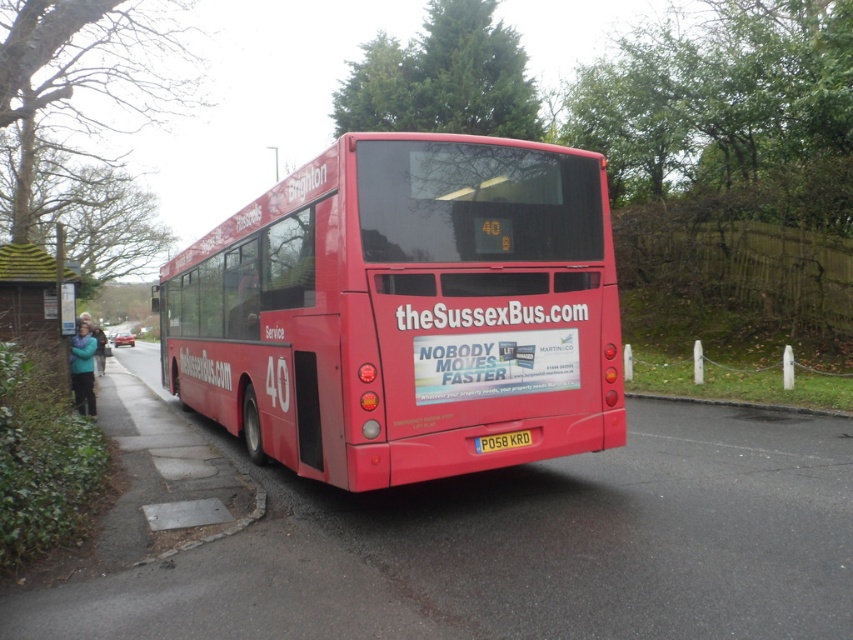
In the scene shown: Does wooden thatched roof at left appear on the left side of yellow plastic license plate at center?

Indeed, wooden thatched roof at left is positioned on the left side of yellow plastic license plate at center.

At what (x,y) coordinates should I click in order to perform the action: click on wooden thatched roof at left. Please return your answer as a coordinate pair (x, y). Image resolution: width=853 pixels, height=640 pixels. Looking at the image, I should click on (36, 305).

Find the location of a particular element. This screenshot has height=640, width=853. wooden thatched roof at left is located at coordinates (36, 305).

Can you confirm if matte red bus at center is positioned to the right of wooden thatched roof at left?

Correct, you'll find matte red bus at center to the right of wooden thatched roof at left.

Between point (471, 308) and point (16, 276), which one is positioned behind?

Point (16, 276)

Where is `matte red bus at center`? Image resolution: width=853 pixels, height=640 pixels. matte red bus at center is located at coordinates coord(405,310).

You are a GUI agent. You are given a task and a screenshot of the screen. Output one action in this format:
    pyautogui.click(x=<x>, y=<y>)
    Task: Click on the matte red bus at center
    This screenshot has width=853, height=640.
    Given the screenshot: What is the action you would take?
    pyautogui.click(x=405, y=310)

Is matte red bus at center thinner than yellow plastic license plate at center?

Incorrect, matte red bus at center's width is not less than yellow plastic license plate at center's.

The image size is (853, 640). Describe the element at coordinates (405, 310) in the screenshot. I see `matte red bus at center` at that location.

Who is more forward, (x=260, y=273) or (x=486, y=444)?

Positioned in front is point (x=486, y=444).

Identify the location of matte red bus at center. (405, 310).